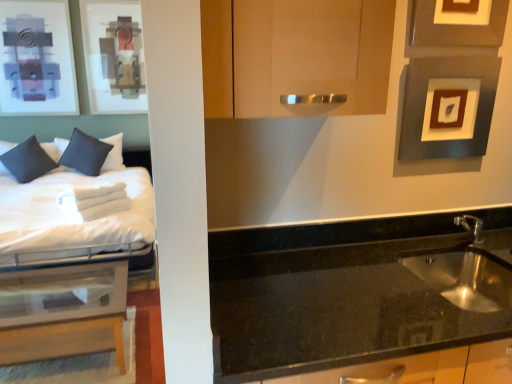
Question: Does black granite sink at lower right come in front of matte wood cabinet at center?

Choices:
 (A) no
 (B) yes

Answer: (B)

Question: Is black granite sink at lower right thinner than matte wood cabinet at center?

Choices:
 (A) yes
 (B) no

Answer: (B)

Question: Is black granite sink at lower right beside matte wood cabinet at center?

Choices:
 (A) no
 (B) yes

Answer: (A)

Question: Could you tell me if black granite sink at lower right is facing matte wood cabinet at center?

Choices:
 (A) no
 (B) yes

Answer: (A)

Question: Does black granite sink at lower right have a smaller size compared to matte wood cabinet at center?

Choices:
 (A) no
 (B) yes

Answer: (A)

Question: Would you say black granite sink at lower right is a long distance from matte wood cabinet at center?

Choices:
 (A) yes
 (B) no

Answer: (B)

Question: Is black granite sink at lower right taller than matte gray picture frame at upper right, positioned as the first picture frame in top-to-bottom order?

Choices:
 (A) no
 (B) yes

Answer: (B)

Question: Considering the relative positions of black granite sink at lower right and matte gray picture frame at upper right, positioned as the first picture frame in top-to-bottom order, in the image provided, is black granite sink at lower right to the right of matte gray picture frame at upper right, positioned as the first picture frame in top-to-bottom order, from the viewer's perspective?

Choices:
 (A) no
 (B) yes

Answer: (A)

Question: From a real-world perspective, is black granite sink at lower right positioned over matte gray picture frame at upper right, which ranks as the 2th picture frame in bottom-to-top order, based on gravity?

Choices:
 (A) no
 (B) yes

Answer: (A)

Question: Is matte gray picture frame at upper right, positioned as the first picture frame in top-to-bottom order, located within black granite sink at lower right?

Choices:
 (A) no
 (B) yes

Answer: (A)

Question: Does black granite sink at lower right have a smaller size compared to matte gray picture frame at upper right, positioned as the first picture frame in top-to-bottom order?

Choices:
 (A) yes
 (B) no

Answer: (B)

Question: From the image's perspective, is black granite sink at lower right on matte gray picture frame at upper right, positioned as the first picture frame in top-to-bottom order?

Choices:
 (A) yes
 (B) no

Answer: (B)

Question: From the image's perspective, is white soft bed at left located above dark blue fabric pillow at left, which appears as the second pillow when viewed from the right?

Choices:
 (A) yes
 (B) no

Answer: (B)